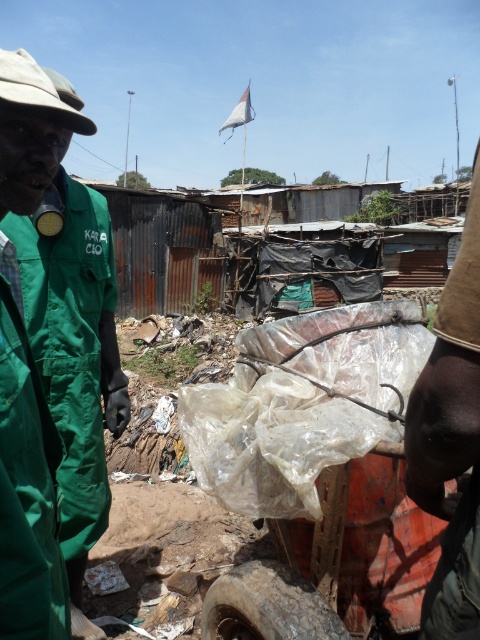
You are standing in front of the cart loaded with plastic bags and debris. There are two points marked on the cart. The first point is at coordinates point (431, 420) and the second is at point (207, 589). Which point is closer to you?

The point at coordinates point (431, 420) is closer to the camera than point (207, 589), so the first point is closer to you.

You are a delivery person trying to navigate through the area. There is a brown fabric cap at upper right and a rusty rubber tire at lower center in your path. Which object should you avoid hitting first?

The brown fabric cap at upper right is closer to the viewer than the rusty rubber tire at lower center, so you should avoid hitting the brown fabric cap at upper right first.

You are a delivery person needing to place a package between the green fabric jacket at left and the brown fabric cap at upper right. Can you fit a 3.5 feet long package between them?

The distance between the green fabric jacket at left and the brown fabric cap at upper right is 4.46 feet, so yes, a 3.5 feet long package can fit between them since it is shorter than the available space.